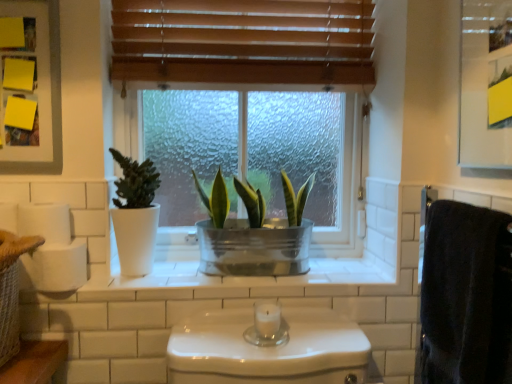
Question: Is metallic green plant at center, the first houseplant positioned from the right, located outside yellow paper at upper left, arranged as the first medicine cabinet when viewed from the back?

Choices:
 (A) no
 (B) yes

Answer: (B)

Question: From a real-world perspective, is metallic green plant at center, the second houseplant in the left-to-right sequence, beneath yellow paper at upper left, arranged as the first medicine cabinet when viewed from the back?

Choices:
 (A) yes
 (B) no

Answer: (A)

Question: From a real-world perspective, is metallic green plant at center, the first houseplant positioned from the right, positioned over yellow paper at upper left, arranged as the first medicine cabinet when viewed from the back, based on gravity?

Choices:
 (A) no
 (B) yes

Answer: (A)

Question: Is metallic green plant at center, the second houseplant in the left-to-right sequence, to the left of yellow paper at upper left, arranged as the first medicine cabinet when viewed from the back, from the viewer's perspective?

Choices:
 (A) no
 (B) yes

Answer: (A)

Question: Is metallic green plant at center, the first houseplant positioned from the right, bigger than yellow paper at upper left, arranged as the first medicine cabinet when viewed from the back?

Choices:
 (A) no
 (B) yes

Answer: (B)

Question: In terms of width, does metallic green plant at center, the first houseplant positioned from the right, look wider or thinner when compared to yellow paper at upper left, marked as the first medicine cabinet in a left-to-right arrangement?

Choices:
 (A) wide
 (B) thin

Answer: (A)

Question: Relative to yellow paper at upper left, which is the second medicine cabinet from right to left, is metallic green plant at center, the second houseplant in the left-to-right sequence, in front or behind?

Choices:
 (A) behind
 (B) front

Answer: (A)

Question: From a real-world perspective, is metallic green plant at center, the second houseplant in the left-to-right sequence, above or below yellow paper at upper left, arranged as the first medicine cabinet when viewed from the back?

Choices:
 (A) above
 (B) below

Answer: (B)

Question: Considering the relative positions of metallic green plant at center, the second houseplant in the left-to-right sequence, and yellow paper at upper left, which is the second medicine cabinet from right to left, in the image provided, is metallic green plant at center, the second houseplant in the left-to-right sequence, to the left or to the right of yellow paper at upper left, which is the second medicine cabinet from right to left,?

Choices:
 (A) right
 (B) left

Answer: (A)

Question: From the image's perspective, is wooden blinds at upper center positioned above or below metallic silver medicine cabinet at upper right, marked as the second medicine cabinet in a back-to-front arrangement?

Choices:
 (A) below
 (B) above

Answer: (B)

Question: Is wooden blinds at upper center bigger or smaller than metallic silver medicine cabinet at upper right, acting as the 1th medicine cabinet starting from the right?

Choices:
 (A) big
 (B) small

Answer: (A)

Question: Would you say wooden blinds at upper center is inside or outside metallic silver medicine cabinet at upper right, acting as the 1th medicine cabinet starting from the right?

Choices:
 (A) outside
 (B) inside

Answer: (A)

Question: From their relative heights in the image, would you say wooden blinds at upper center is taller or shorter than metallic silver medicine cabinet at upper right, acting as the 1th medicine cabinet starting from the right?

Choices:
 (A) tall
 (B) short

Answer: (B)

Question: Relative to yellow paper at upper left, which is the second medicine cabinet from right to left, is matte white pot at left, the 2th houseplant positioned from the right, in front or behind?

Choices:
 (A) front
 (B) behind

Answer: (B)

Question: Is matte white pot at left, the first houseplant from the left, to the left or to the right of yellow paper at upper left, arranged as the first medicine cabinet when viewed from the back, in the image?

Choices:
 (A) right
 (B) left

Answer: (A)